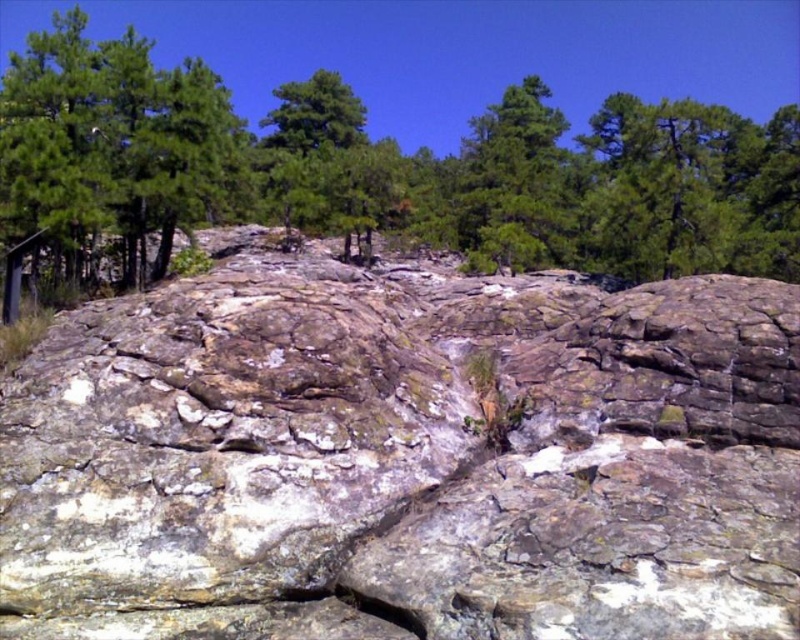
You are a hiker who wants to take a photo of the rocky surface at center and the green leafy tree at upper center. Which object should you focus on first if you want to capture both in a single frame without moving the camera?

You should focus on the green leafy tree at upper center first because it is taller than the rocky surface at center, ensuring it is in focus while the rocky surface at center will naturally be in the foreground and also in focus.

You are a geologist examining the rugged terrain. You need to locate the rocky surface at center. According to the coordinates provided, where exactly would you find it?

The rocky surface at center is located at point coordinates of (404, 458).